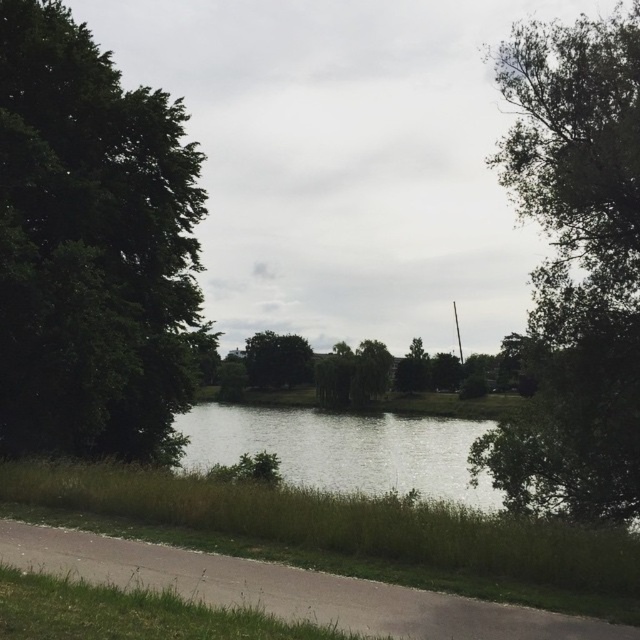
Question: Among these objects, which one is farthest from the camera?

Choices:
 (A) green leafy tree at left
 (B) gray asphalt path at lower center
 (C) green leafy tree at right

Answer: (A)

Question: Which point is closer to the camera?

Choices:
 (A) gray asphalt path at lower center
 (B) green leafy tree at right
 (C) green leafy tree at left

Answer: (A)

Question: Which point is farther from the camera taking this photo?

Choices:
 (A) (621, 273)
 (B) (467, 448)
 (C) (269, 385)

Answer: (C)

Question: From the image, what is the correct spatial relationship of green leafy tree at left in relation to gray asphalt path at lower center?

Choices:
 (A) above
 (B) below

Answer: (A)

Question: From the image, what is the correct spatial relationship of green grassy river at center in relation to green leafy tree at center?

Choices:
 (A) left
 (B) right

Answer: (B)

Question: From the image, what is the correct spatial relationship of gray asphalt path at lower center in relation to green leafy tree at center?

Choices:
 (A) left
 (B) right

Answer: (B)